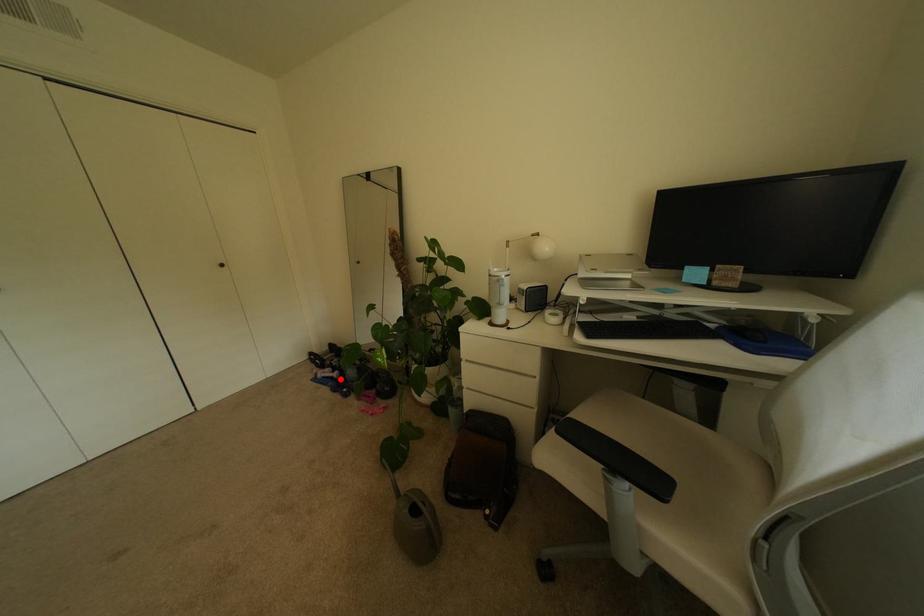
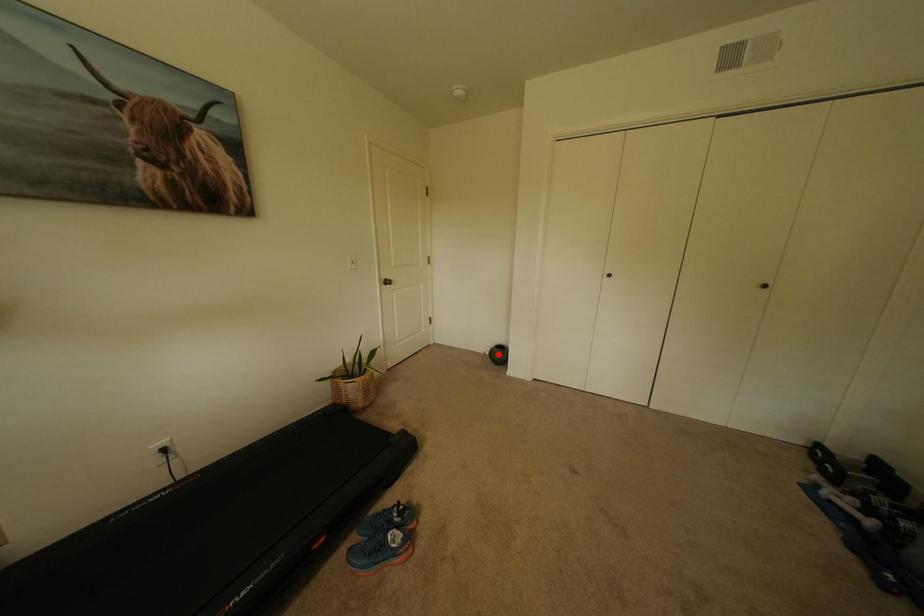
I am providing you with two images of the same scene from different viewpoints. A red point is marked on the first image and another point is marked on the second image. Do the highlighted points in image1 and image2 indicate the same real-world spot?

No